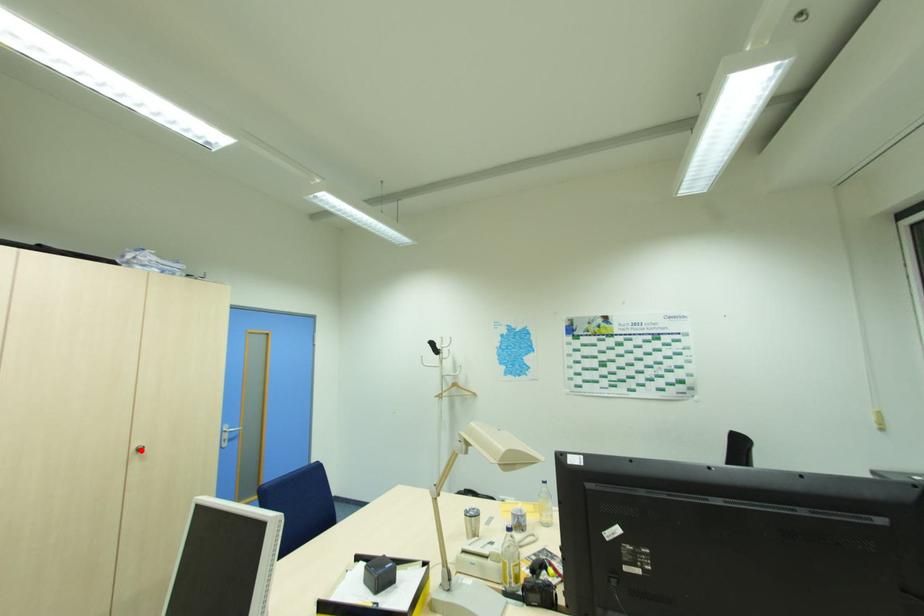
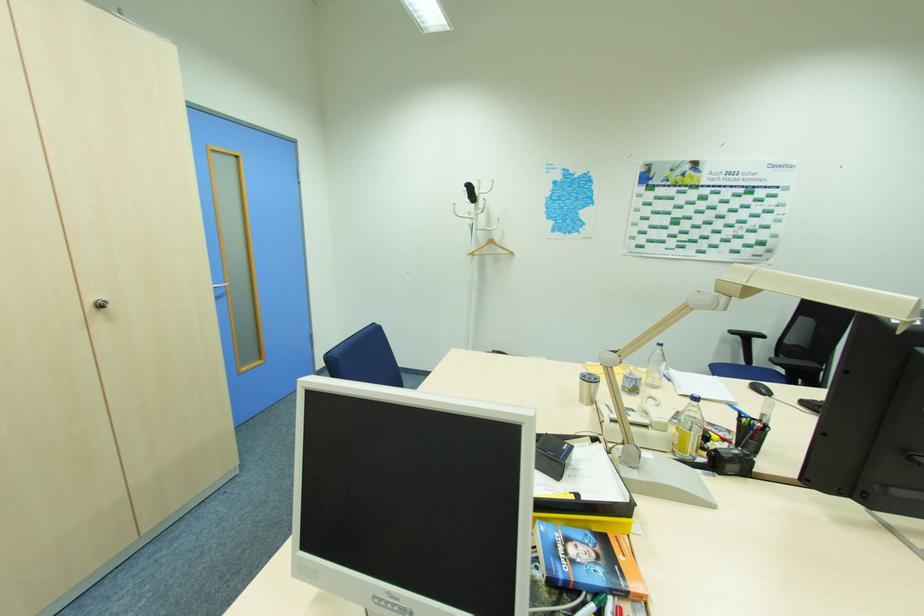
In the second image, find the point that corresponds to the highlighted location in the first image.

(103, 306)